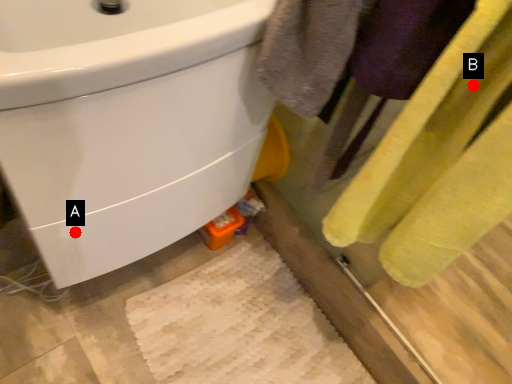
Question: Two points are circled on the image, labeled by A and B beside each circle. Which of the following is the closest to the observer?

Choices:
 (A) A is closer
 (B) B is closer

Answer: (B)